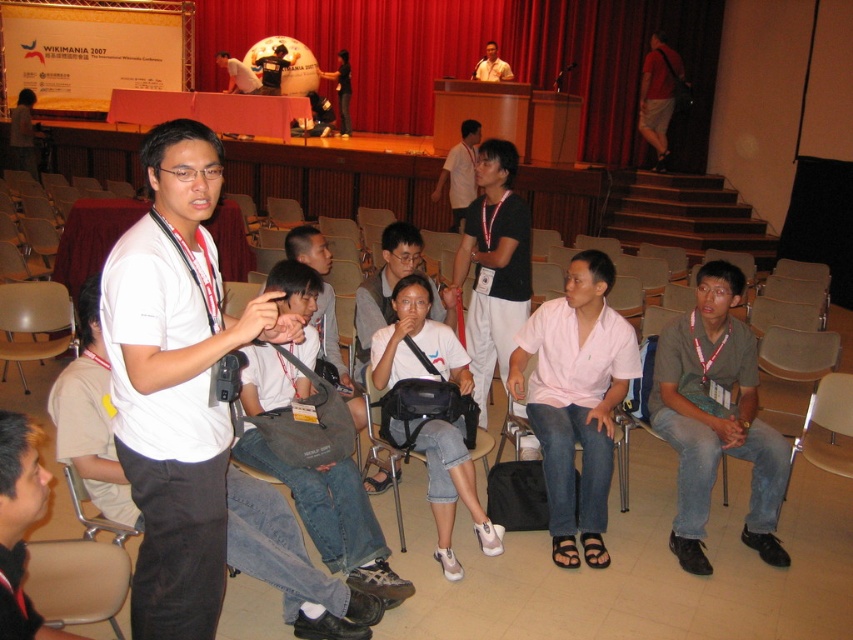
Between pink cotton shirt at center and matte black shirt at center, which one appears on the right side from the viewer's perspective?

pink cotton shirt at center is more to the right.

This screenshot has width=853, height=640. What do you see at coordinates (576, 401) in the screenshot? I see `pink cotton shirt at center` at bounding box center [576, 401].

At what (x,y) coordinates should I click in order to perform the action: click on pink cotton shirt at center. Please return your answer as a coordinate pair (x, y). Image resolution: width=853 pixels, height=640 pixels. Looking at the image, I should click on (576, 401).

Can you confirm if dark gray jeans at lower right is thinner than denim jeans at center?

Correct, dark gray jeans at lower right's width is less than denim jeans at center's.

Is dark gray jeans at lower right positioned behind denim jeans at center?

Yes.

Is point (718, 339) farther from camera compared to point (399, 588)?

Yes, point (718, 339) is behind point (399, 588).

The height and width of the screenshot is (640, 853). I want to click on dark gray jeans at lower right, so click(x=715, y=419).

In the scene shown: Between pink cotton shirt at center and dark brown leather jacket at lower left, which one is positioned lower?

dark brown leather jacket at lower left

Looking at this image, between pink cotton shirt at center and dark brown leather jacket at lower left, which one has more height?

Standing taller between the two is pink cotton shirt at center.

Who is more distant from viewer, (x=526, y=401) or (x=33, y=448)?

Point (x=526, y=401)

This screenshot has height=640, width=853. In order to click on pink cotton shirt at center in this screenshot , I will do `click(576, 401)`.